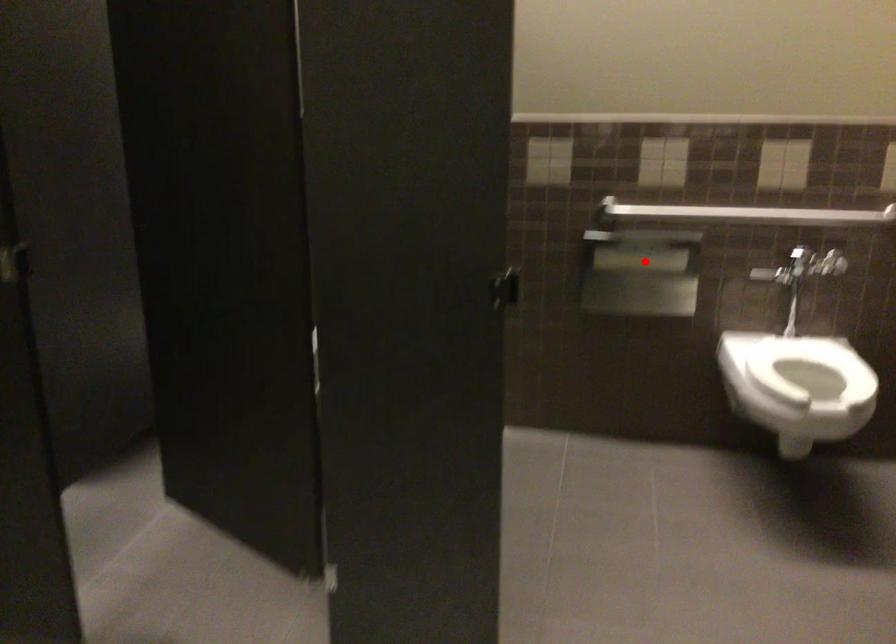
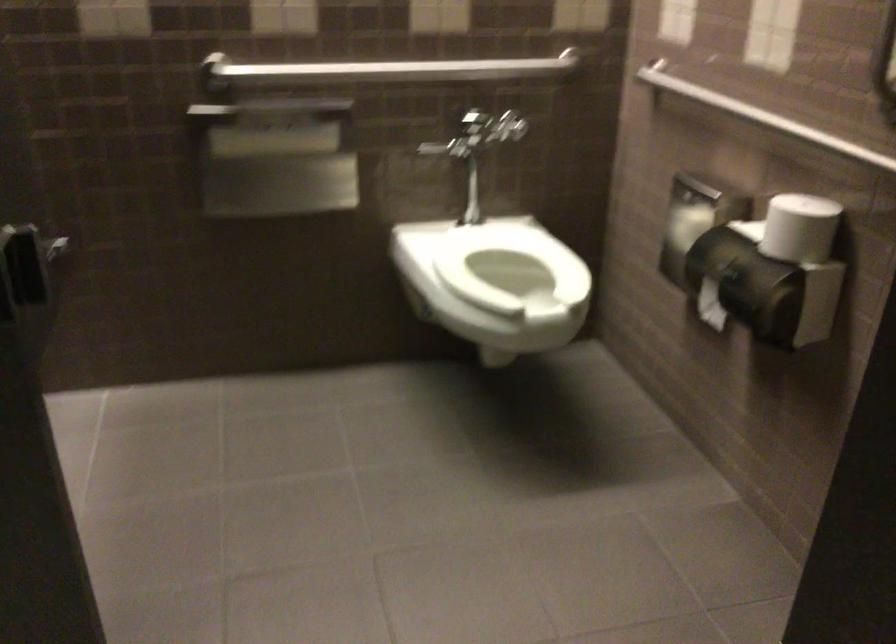
Question: A red point is marked in image1. In image2, is the corresponding 3D point closer to the camera or farther? Reply with the corresponding letter.

Choices:
 (A) The corresponding 3D point is closer.
 (B) The corresponding 3D point is farther.

Answer: (A)